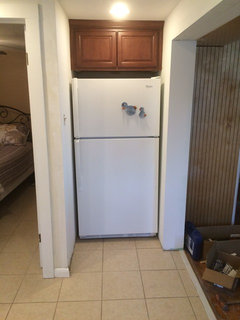
Look for where you open the freezer in the image and show me where they are. Your answer should be formatted as a list of tuples, i.e. [(x1, y1), (x2, y2), ...], where each tuple contains the x and y coordinates of a point satisfying the conditions above.

[(76, 118)]